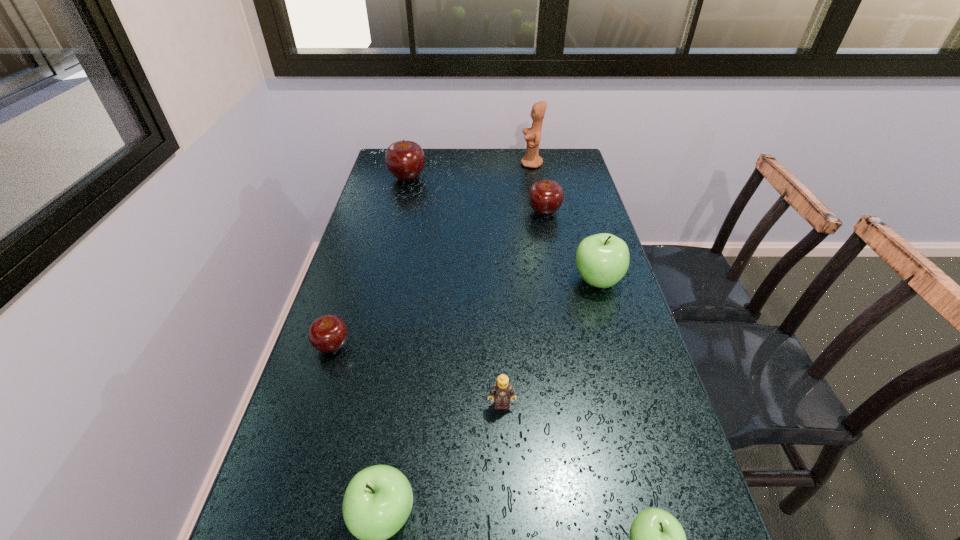
The width and height of the screenshot is (960, 540). Find the location of `free point between the fifth nearest object and the farthest red apple`. free point between the fifth nearest object and the farthest red apple is located at coordinates (502, 229).

Identify the location of object that is the fifth closest to the farthest green apple. (328, 333).

Locate which object ranks seventh in proximity to the rightmost red apple. Please provide its 2D coordinates. Your answer should be formatted as a tuple, i.e. [(x, y)], where the tuple contains the x and y coordinates of a point satisfying the conditions above.

[(657, 539)]

The width and height of the screenshot is (960, 540). I want to click on apple that is the closest to the farthest green apple, so click(x=545, y=197).

Locate which apple ranks sixth in proximity to the figurine. Please provide its 2D coordinates. Your answer should be formatted as a tuple, i.e. [(x, y)], where the tuple contains the x and y coordinates of a point satisfying the conditions above.

[(657, 539)]

The width and height of the screenshot is (960, 540). I want to click on red apple that is the third nearest to the second biggest green apple, so click(405, 160).

Find the location of a particular element. The image size is (960, 540). red apple that is the second nearest to the fourth object from left to right is located at coordinates (545, 197).

Select which green apple appears as the second closest to the tan Lego. Please provide its 2D coordinates. Your answer should be formatted as a tuple, i.e. [(x, y)], where the tuple contains the x and y coordinates of a point satisfying the conditions above.

[(657, 539)]

Select which green apple is the third closest to the sixth nearest object. Please provide its 2D coordinates. Your answer should be formatted as a tuple, i.e. [(x, y)], where the tuple contains the x and y coordinates of a point satisfying the conditions above.

[(657, 539)]

Locate an element on the screen. vacant space that satisfies the following two spatial constraints: 1. on the front-facing side of the figurine; 2. on the back side of the biggest green apple is located at coordinates (553, 281).